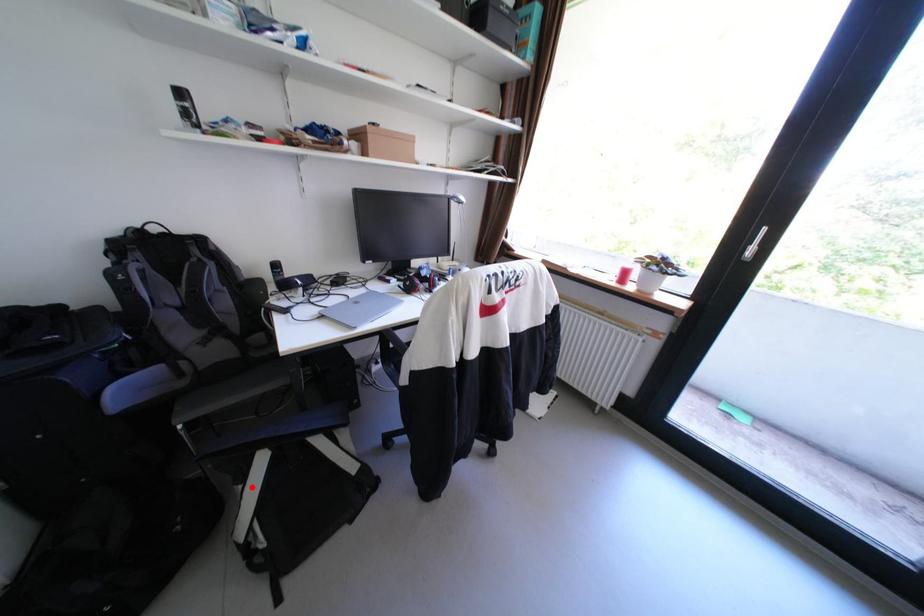
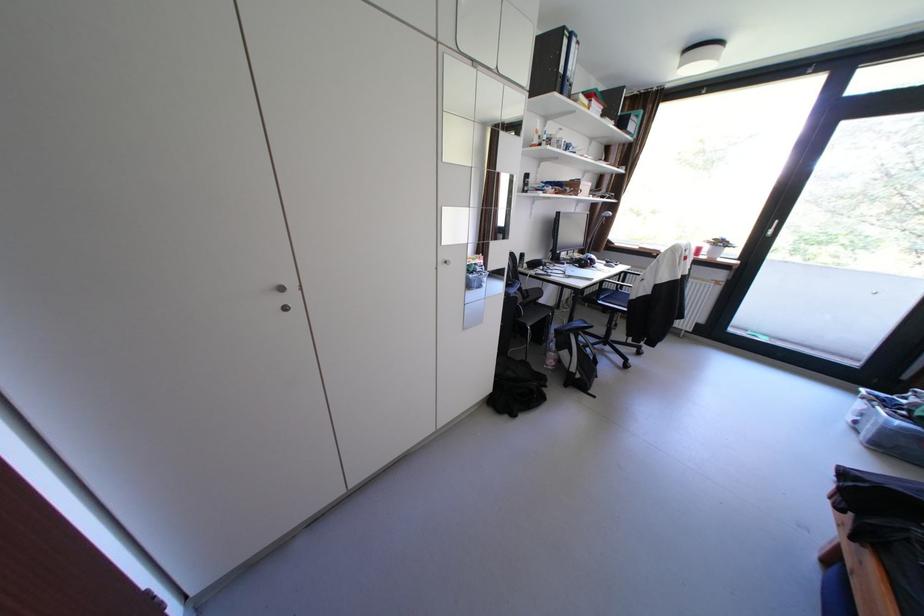
Question: I am providing you with two images of the same scene from different viewpoints. A red point is marked on the first image. At the location where the point appears in image 1, is it still visible in image 2?

Choices:
 (A) Yes
 (B) No

Answer: (A)